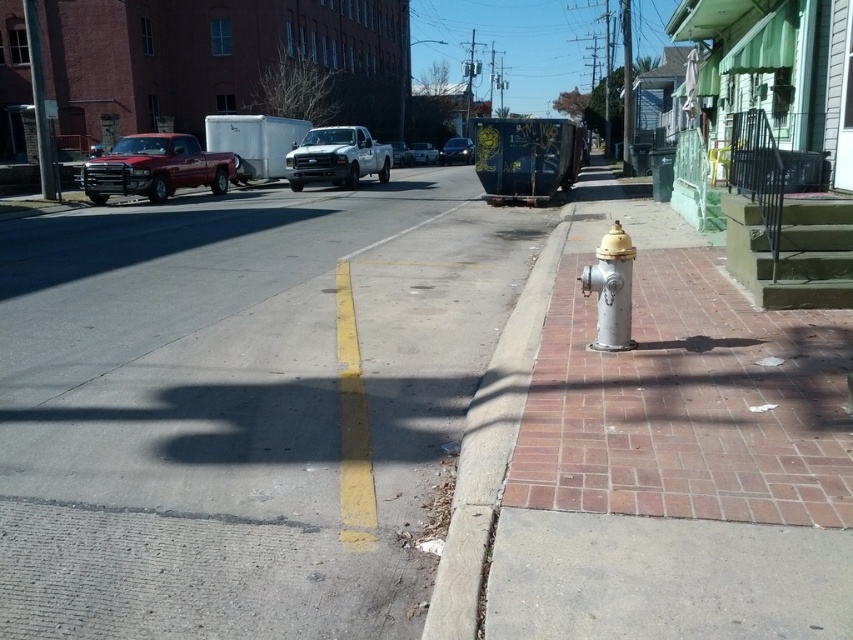
Where is `white matte truck at center`? The width and height of the screenshot is (853, 640). white matte truck at center is located at coordinates 335,157.

Is white matte truck at center closer to camera compared to matte white truck at center?

Yes, it is in front of matte white truck at center.

In order to click on white matte truck at center in this screenshot , I will do `click(335, 157)`.

Can you confirm if gray asphalt at center is smaller than white matte truck at center?

No.

Is gray asphalt at center wider than white matte truck at center?

Correct, the width of gray asphalt at center exceeds that of white matte truck at center.

Identify the location of gray asphalt at center. (242, 404).

The width and height of the screenshot is (853, 640). In order to click on gray asphalt at center in this screenshot , I will do `click(242, 404)`.

Does concrete at right appear on the right side of metallic silver truck at center?

Yes, concrete at right is to the right of metallic silver truck at center.

Find the location of a particular element. The height and width of the screenshot is (640, 853). concrete at right is located at coordinates (490, 451).

You are a GUI agent. You are given a task and a screenshot of the screen. Output one action in this format:
    pyautogui.click(x=<x>, y=<y>)
    Task: Click on the concrete at right
    This screenshot has width=853, height=640.
    Given the screenshot: What is the action you would take?
    pyautogui.click(x=490, y=451)